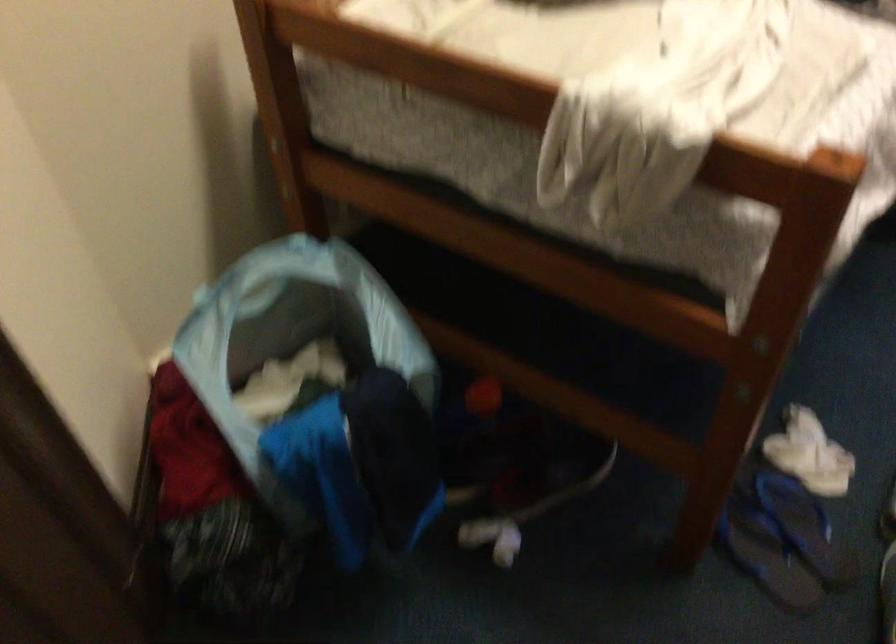
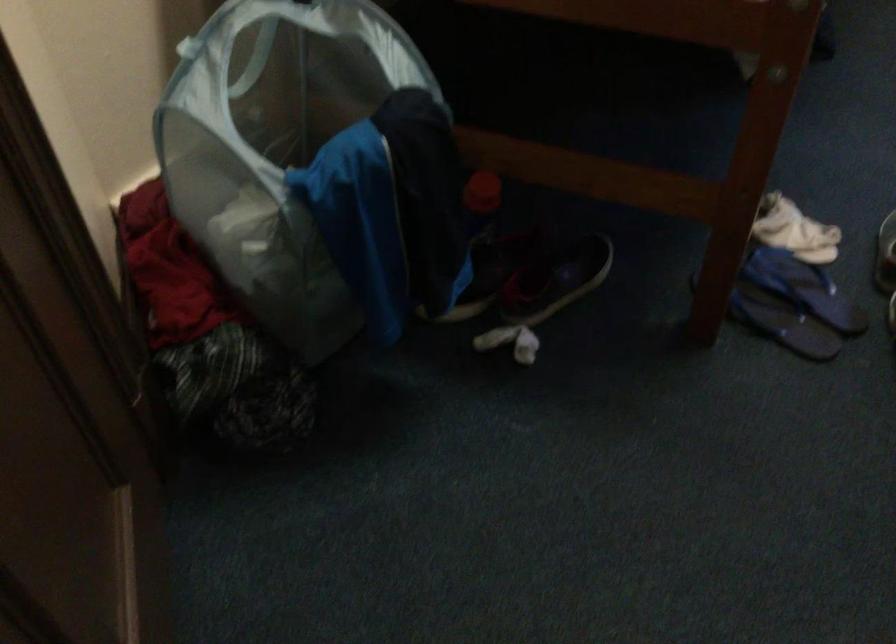
In the second image, find the point that corresponds to [547,488] in the first image.

(556, 279)